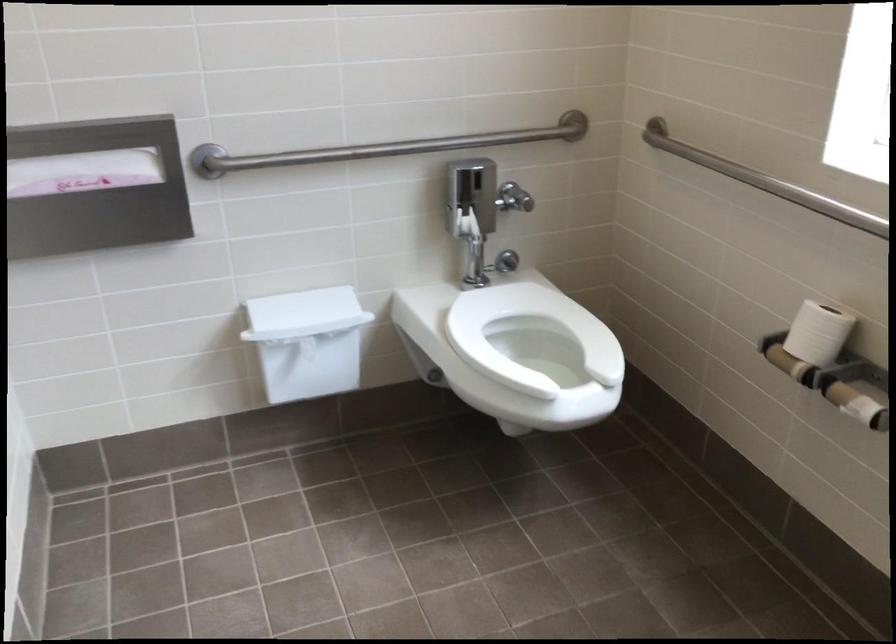
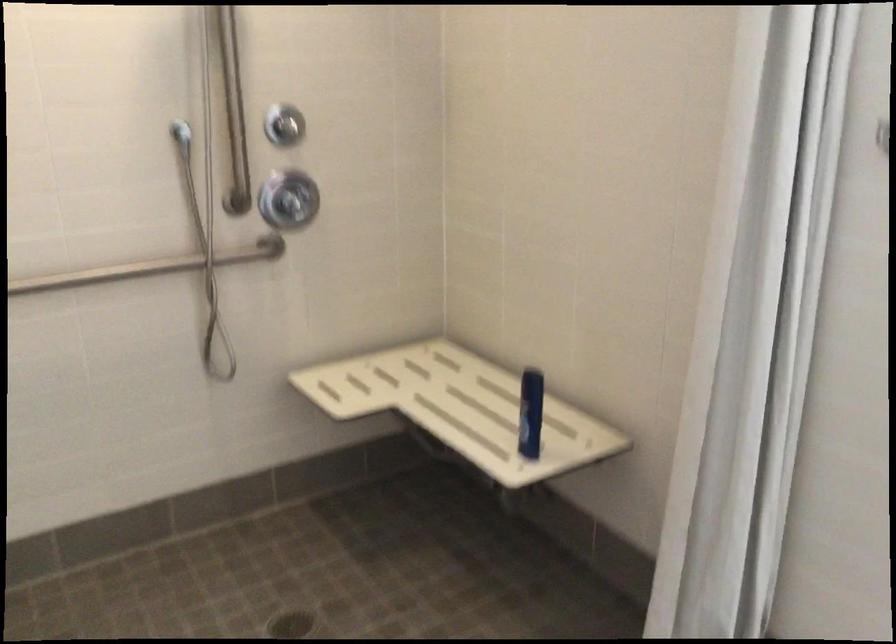
Question: I am providing you with two images of the same scene from different viewpoints. Please identify which objects are invisible in image2.

Choices:
 (A) metal grab bar
 (B) white toilet seat
 (C) pink liquor bottle
 (D) small chrome knob

Answer: (B)